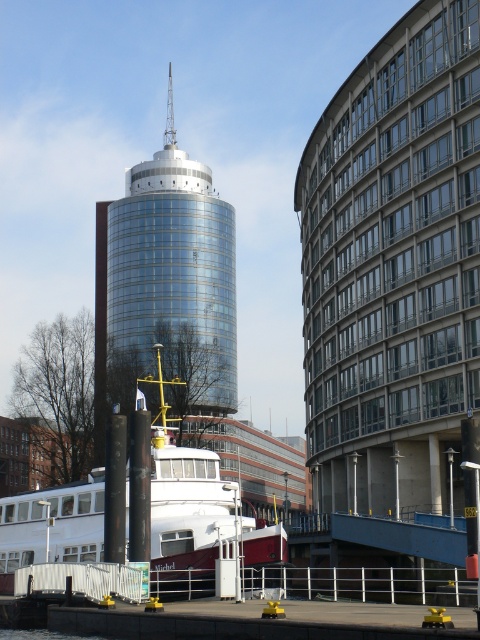
Question: Among these objects, which one is farthest from the camera?

Choices:
 (A) transparent water at lower left
 (B) shiny glass tower at center
 (C) white glossy boat at center

Answer: (B)

Question: Does shiny glass tower at center appear over transparent water at lower left?

Choices:
 (A) no
 (B) yes

Answer: (B)

Question: Which is farther from the shiny glass tower at center?

Choices:
 (A) transparent water at lower left
 (B) white glossy boat at center

Answer: (A)

Question: Observing the image, what is the correct spatial positioning of shiny glass tower at center in reference to white glossy boat at center?

Choices:
 (A) above
 (B) below

Answer: (A)

Question: Which object is the farthest from the transparent water at lower left?

Choices:
 (A) white glossy boat at center
 (B) shiny glass tower at center

Answer: (B)

Question: Can you confirm if shiny glass tower at center is positioned above transparent water at lower left?

Choices:
 (A) yes
 (B) no

Answer: (A)